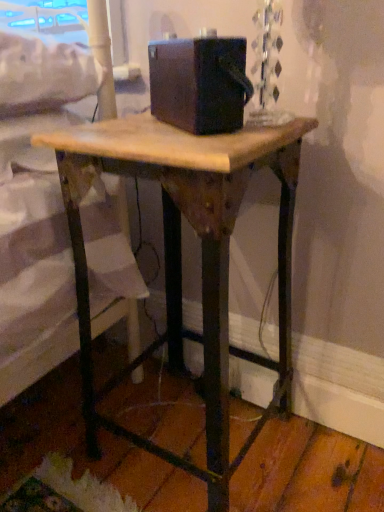
Identify the location of matte black box at center. (199, 83).

Describe the element at coordinates (199, 83) in the screenshot. I see `matte black box at center` at that location.

In order to face matte black box at center, should I rotate leftwards or rightwards?

You should rotate right by 0.035 degrees.

What do you see at coordinates (181, 255) in the screenshot? I see `wooden table at center` at bounding box center [181, 255].

Measure the distance between wooden table at center and camera.

wooden table at center and camera are 21.21 inches apart from each other.

In order to click on wooden table at center in this screenshot , I will do `click(181, 255)`.

Measure the distance between point (217, 321) and camera.

The distance of point (217, 321) from camera is 24.41 inches.

Identify the location of matte black box at center. tap(199, 83).

Can you confirm if matte black box at center is positioned to the left of wooden table at center?

No.

From the picture: Is the depth of matte black box at center less than that of wooden table at center?

No.

Considering the positions of point (159, 60) and point (298, 147), is point (159, 60) closer or farther from the camera than point (298, 147)?

Point (159, 60) is positioned closer to the camera compared to point (298, 147).

From the image's perspective, is matte black box at center above or below wooden table at center?

Based on their image positions, matte black box at center is located above wooden table at center.

From a real-world perspective, does matte black box at center stand above wooden table at center?

Indeed, from a real-world perspective, matte black box at center stands above wooden table at center.

Can you confirm if matte black box at center is wider than wooden table at center?

Incorrect, the width of matte black box at center does not surpass that of wooden table at center.

In the scene shown: Between matte black box at center and wooden table at center, which one has less height?

Standing shorter between the two is matte black box at center.

Looking at this image, between matte black box at center and wooden table at center, which one has smaller size?

Result: matte black box at center is smaller.

Is matte black box at center not inside wooden table at center?

That's correct, matte black box at center is outside of wooden table at center.

Is matte black box at center directly adjacent to wooden table at center?

No, matte black box at center is not beside wooden table at center.

Is matte black box at center facing away from wooden table at center?

matte black box at center does not have its back to wooden table at center.

What's the angular difference between matte black box at center and wooden table at center's facing directions?

They differ by 36.6 degrees in their facing directions.

The image size is (384, 512). Find the location of `box behind the wooden table at center`. box behind the wooden table at center is located at coordinates (199, 83).

From the picture: Which object is positioned more to the left, wooden table at center or matte black box at center?

wooden table at center.

Which object is further away from the camera taking this photo, wooden table at center or matte black box at center?

matte black box at center is more distant.

Is point (218, 327) farther from viewer compared to point (213, 79)?

Yes, point (218, 327) is farther from viewer.

From the image's perspective, is wooden table at center positioned above or below matte black box at center?

wooden table at center is below matte black box at center.

Consider the image. From a real-world perspective, which is physically above, wooden table at center or matte black box at center?

In real-world perspective, matte black box at center is above.

Can you confirm if wooden table at center is thinner than matte black box at center?

In fact, wooden table at center might be wider than matte black box at center.

Between wooden table at center and matte black box at center, which one has less height?

With less height is matte black box at center.

Does wooden table at center have a larger size compared to matte black box at center?

Correct, wooden table at center is larger in size than matte black box at center.

Is wooden table at center positioned beyond the bounds of matte black box at center?

wooden table at center is positioned outside matte black box at center.

Is wooden table at center positioned far away from matte black box at center?

They are positioned close to each other.

Is matte black box at center at the back of wooden table at center?

No.

How different are the orientations of wooden table at center and matte black box at center in degrees?

36.6 degrees.

The height and width of the screenshot is (512, 384). Identify the location of table on the left side of matte black box at center. (181, 255).

Identify the location of box above the wooden table at center (from the image's perspective). (199, 83).

Where is `box lying behind the wooden table at center`? box lying behind the wooden table at center is located at coordinates (199, 83).